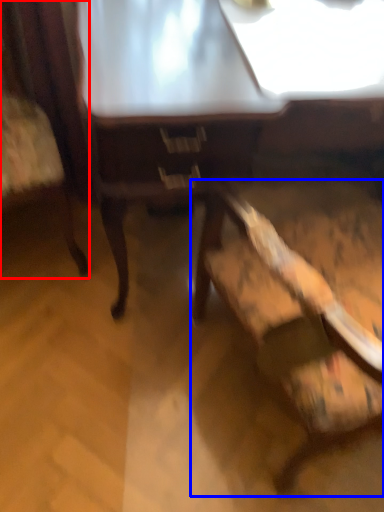
Question: Among these objects, which one is farthest to the camera, chair (highlighted by a red box) or chair (highlighted by a blue box)?

Choices:
 (A) chair
 (B) chair

Answer: (A)